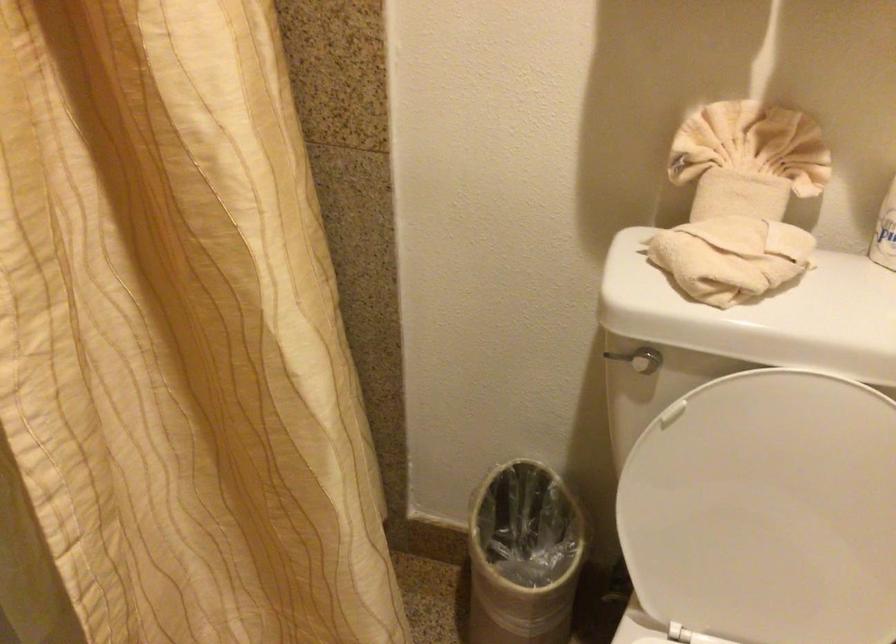
Find the location of `white toilet lid`. white toilet lid is located at coordinates (767, 511).